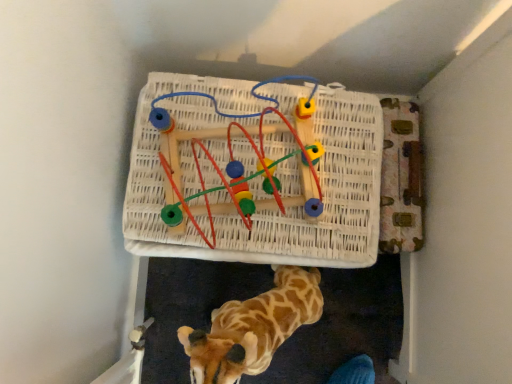
The image size is (512, 384). What do you see at coordinates (239, 161) in the screenshot? I see `woven wood maze at upper center` at bounding box center [239, 161].

This screenshot has height=384, width=512. What are the coordinates of `woven wood maze at upper center` in the screenshot? It's located at (239, 161).

Measure the distance between spotted plush giraffe at lower center and camera.

They are 60.80 centimeters apart.

The height and width of the screenshot is (384, 512). Identify the location of spotted plush giraffe at lower center. pyautogui.click(x=253, y=328).

Image resolution: width=512 pixels, height=384 pixels. What do you see at coordinates (253, 328) in the screenshot?
I see `spotted plush giraffe at lower center` at bounding box center [253, 328].

Locate an element on the screen. The image size is (512, 384). woven wood maze at upper center is located at coordinates (239, 161).

Consider the image. In the image, is woven wood maze at upper center on the left side or the right side of spotted plush giraffe at lower center?

woven wood maze at upper center is to the left of spotted plush giraffe at lower center.

Is the depth of woven wood maze at upper center greater than that of spotted plush giraffe at lower center?

That is True.

Is point (303, 77) more distant than point (203, 371)?

That is True.

From the image's perspective, is woven wood maze at upper center beneath spotted plush giraffe at lower center?

Incorrect, from the image's perspective, woven wood maze at upper center is higher than spotted plush giraffe at lower center.

Looking at this image, from a real-world perspective, is woven wood maze at upper center positioned over spotted plush giraffe at lower center based on gravity?

Yes, from a real-world perspective, woven wood maze at upper center is over spotted plush giraffe at lower center

Looking at their sizes, would you say woven wood maze at upper center is wider or thinner than spotted plush giraffe at lower center?

woven wood maze at upper center is wider than spotted plush giraffe at lower center.

Which of these two, woven wood maze at upper center or spotted plush giraffe at lower center, stands shorter?

With less height is woven wood maze at upper center.

Is woven wood maze at upper center smaller than spotted plush giraffe at lower center?

Correct, woven wood maze at upper center occupies less space than spotted plush giraffe at lower center.

Is woven wood maze at upper center situated inside spotted plush giraffe at lower center or outside?

woven wood maze at upper center cannot be found inside spotted plush giraffe at lower center.

Is woven wood maze at upper center directly adjacent to spotted plush giraffe at lower center?

No.

Is woven wood maze at upper center aimed at spotted plush giraffe at lower center?

Yes, woven wood maze at upper center is turned towards spotted plush giraffe at lower center.

What's the angular difference between woven wood maze at upper center and spotted plush giraffe at lower center's facing directions?

The angle between the facing direction of woven wood maze at upper center and the facing direction of spotted plush giraffe at lower center is 34.5 degrees.

Locate an element on the screen. This screenshot has height=384, width=512. giraffe on the right of woven wood maze at upper center is located at coordinates (253, 328).

Between spotted plush giraffe at lower center and woven wood maze at upper center, which one appears on the right side from the viewer's perspective?

spotted plush giraffe at lower center.

In the image, is spotted plush giraffe at lower center positioned in front of or behind woven wood maze at upper center?

spotted plush giraffe at lower center is in front of woven wood maze at upper center.

Is point (234, 352) behind point (206, 196)?

No, it is in front of (206, 196).

From the image's perspective, relative to woven wood maze at upper center, is spotted plush giraffe at lower center above or below?

Based on their image positions, spotted plush giraffe at lower center is located beneath woven wood maze at upper center.

From a real-world perspective, relative to woven wood maze at upper center, is spotted plush giraffe at lower center vertically above or below?

Clearly, from a real-world perspective, spotted plush giraffe at lower center is below woven wood maze at upper center.

Consider the image. Does spotted plush giraffe at lower center have a greater width compared to woven wood maze at upper center?

No, spotted plush giraffe at lower center is not wider than woven wood maze at upper center.

Considering the sizes of spotted plush giraffe at lower center and woven wood maze at upper center in the image, is spotted plush giraffe at lower center taller or shorter than woven wood maze at upper center?

Clearly, spotted plush giraffe at lower center is taller compared to woven wood maze at upper center.

Is spotted plush giraffe at lower center smaller than woven wood maze at upper center?

No, spotted plush giraffe at lower center is not smaller than woven wood maze at upper center.

Is spotted plush giraffe at lower center inside or outside of woven wood maze at upper center?

spotted plush giraffe at lower center is located beyond the bounds of woven wood maze at upper center.

Does spotted plush giraffe at lower center touch woven wood maze at upper center?

They are not placed beside each other.

Is spotted plush giraffe at lower center looking in the opposite direction of woven wood maze at upper center?

Yes.

From the picture: How different are the orientations of spotted plush giraffe at lower center and woven wood maze at upper center in degrees?

spotted plush giraffe at lower center and woven wood maze at upper center are facing 34.5 degrees away from each other.

The width and height of the screenshot is (512, 384). Find the location of `toy to the left of spotted plush giraffe at lower center`. toy to the left of spotted plush giraffe at lower center is located at coordinates (239, 161).

Locate an element on the screen. The width and height of the screenshot is (512, 384). toy that is above the spotted plush giraffe at lower center (from a real-world perspective) is located at coordinates (239, 161).

Locate an element on the screen. The height and width of the screenshot is (384, 512). giraffe beneath the woven wood maze at upper center (from a real-world perspective) is located at coordinates (253, 328).